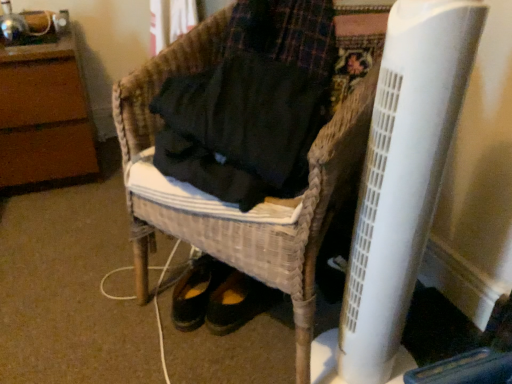
Question: From a real-world perspective, is woven wicker chair at center, arranged as the 2th furniture when viewed from the left, on white plastic radiator at lower right?

Choices:
 (A) yes
 (B) no

Answer: (B)

Question: Is the depth of woven wicker chair at center, which ranks as the first furniture in front-to-back order, greater than that of white plastic radiator at lower right?

Choices:
 (A) yes
 (B) no

Answer: (A)

Question: Is woven wicker chair at center, marked as the 2th furniture in a back-to-front arrangement, at the right side of white plastic radiator at lower right?

Choices:
 (A) no
 (B) yes

Answer: (A)

Question: From the image's perspective, is woven wicker chair at center, marked as the 2th furniture in a back-to-front arrangement, located beneath white plastic radiator at lower right?

Choices:
 (A) no
 (B) yes

Answer: (A)

Question: Is the depth of woven wicker chair at center, which appears as the 1th furniture when viewed from the right, less than that of white plastic radiator at lower right?

Choices:
 (A) yes
 (B) no

Answer: (B)

Question: Is white plastic radiator at lower right wider or thinner than brown wood dresser at upper left, positioned as the first furniture in back-to-front order?

Choices:
 (A) thin
 (B) wide

Answer: (A)

Question: Would you say white plastic radiator at lower right is to the left or to the right of brown wood dresser at upper left, positioned as the second furniture in right-to-left order, in the picture?

Choices:
 (A) right
 (B) left

Answer: (A)

Question: In terms of size, does white plastic radiator at lower right appear bigger or smaller than brown wood dresser at upper left, positioned as the second furniture in front-to-back order?

Choices:
 (A) big
 (B) small

Answer: (B)

Question: Considering the positions of point (x=378, y=240) and point (x=25, y=54), is point (x=378, y=240) closer or farther from the camera than point (x=25, y=54)?

Choices:
 (A) closer
 (B) farther

Answer: (A)

Question: Is point (27, 72) positioned closer to the camera than point (309, 190)?

Choices:
 (A) closer
 (B) farther

Answer: (B)

Question: In terms of size, does brown wood dresser at upper left, positioned as the second furniture in front-to-back order, appear bigger or smaller than woven wicker chair at center, marked as the 2th furniture in a back-to-front arrangement?

Choices:
 (A) big
 (B) small

Answer: (B)

Question: In terms of height, does brown wood dresser at upper left, positioned as the second furniture in front-to-back order, look taller or shorter compared to woven wicker chair at center, which appears as the 1th furniture when viewed from the right?

Choices:
 (A) tall
 (B) short

Answer: (B)

Question: Choose the correct answer: Is brown wood dresser at upper left, positioned as the second furniture in front-to-back order, inside woven wicker chair at center, marked as the 2th furniture in a back-to-front arrangement, or outside it?

Choices:
 (A) outside
 (B) inside

Answer: (A)

Question: Is point (250, 259) closer or farther from the camera than point (59, 56)?

Choices:
 (A) farther
 (B) closer

Answer: (B)

Question: Is woven wicker chair at center, marked as the 2th furniture in a back-to-front arrangement, spatially inside brown wood dresser at upper left, positioned as the first furniture in back-to-front order, or outside of it?

Choices:
 (A) outside
 (B) inside

Answer: (A)